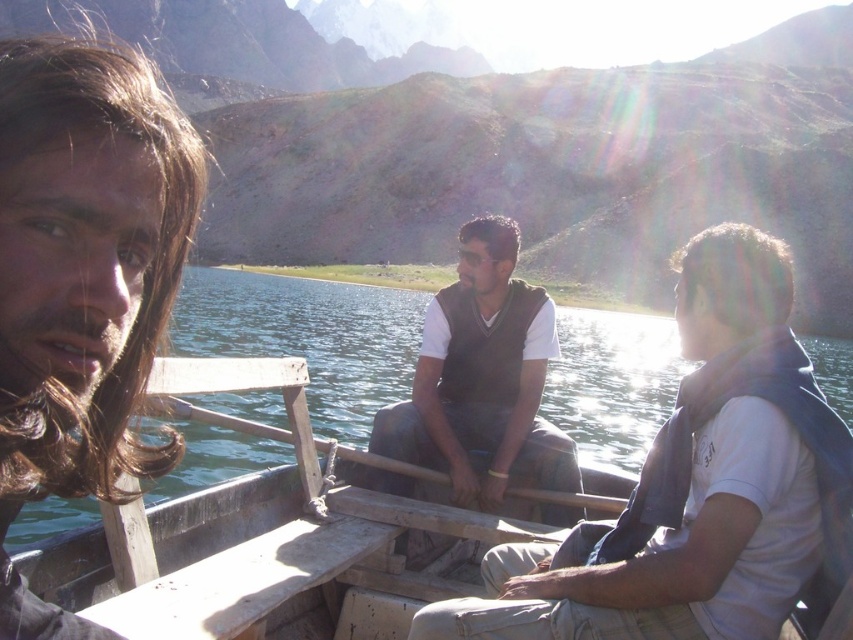
Consider the image. Can you confirm if clear water at boat center is bigger than brown suede vest at center?

Yes.

Between clear water at boat center and brown suede vest at center, which one appears on the left side from the viewer's perspective?

Positioned to the left is brown suede vest at center.

Between point (15, 524) and point (467, 316), which one is positioned in front?

Point (467, 316)

Identify the location of clear water at boat center. (308, 337).

Does dark brown hair at left lie behind clear water at boat center?

No.

Is dark brown hair at left taller than clear water at boat center?

Correct, dark brown hair at left is much taller as clear water at boat center.

Is point (97, 480) closer to camera compared to point (310, 310)?

Yes, point (97, 480) is in front of point (310, 310).

Find the location of `dark brown hair at left`. dark brown hair at left is located at coordinates (82, 280).

Can you confirm if dark brown hair at left is smaller than brown suede vest at center?

No.

Who is more distant from viewer, (103,192) or (498,266)?

The point (498,266) is more distant.

The image size is (853, 640). Find the location of `dark brown hair at left`. dark brown hair at left is located at coordinates (82, 280).